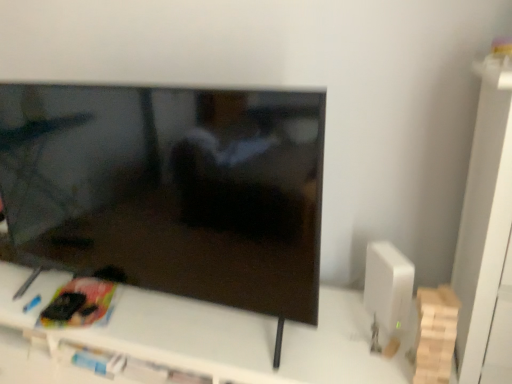
Locate an element on the screen. The width and height of the screenshot is (512, 384). free space above white plastic tv stand at center (from a real-world perspective) is located at coordinates (241, 327).